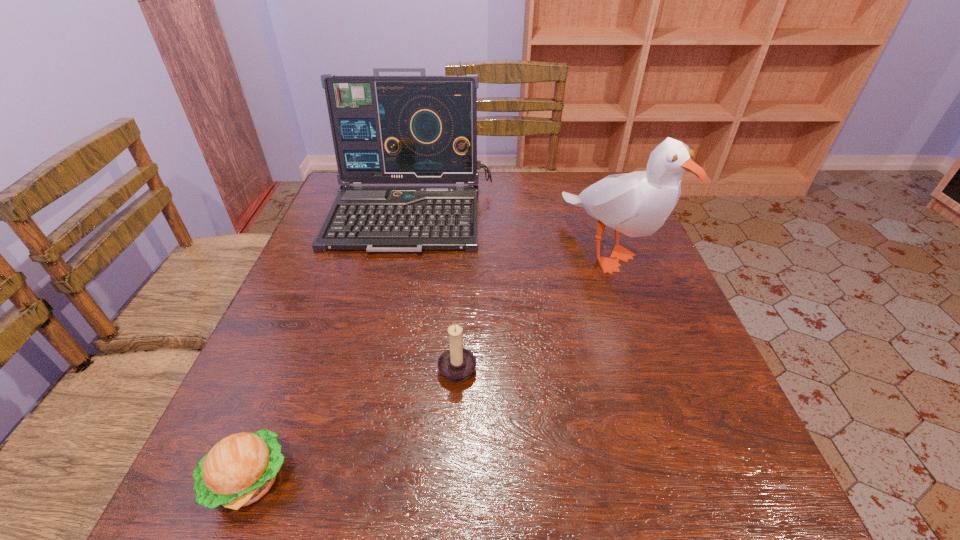
The height and width of the screenshot is (540, 960). Find the location of `vacant area that lies between the nearest object and the candle holder`. vacant area that lies between the nearest object and the candle holder is located at coordinates (353, 423).

Identify the location of vacant space that's between the laptop computer and the nearest object. The height and width of the screenshot is (540, 960). (330, 347).

Locate an element on the screen. The height and width of the screenshot is (540, 960). blank region between the rightmost object and the laptop computer is located at coordinates (510, 232).

Find the location of a particular element. The width and height of the screenshot is (960, 540). the second closest object relative to the shortest object is located at coordinates (422, 129).

Select which object appears as the closest to the shortest object. Please provide its 2D coordinates. Your answer should be formatted as a tuple, i.e. [(x, y)], where the tuple contains the x and y coordinates of a point satisfying the conditions above.

[(456, 364)]

You are a GUI agent. You are given a task and a screenshot of the screen. Output one action in this format:
    pyautogui.click(x=<x>, y=<y>)
    Task: Click on the free space in the image that satisfies the following two spatial constraints: 1. at the beak of the gull; 2. on the wick of the candle holder
    
    Given the screenshot: What is the action you would take?
    pyautogui.click(x=649, y=366)